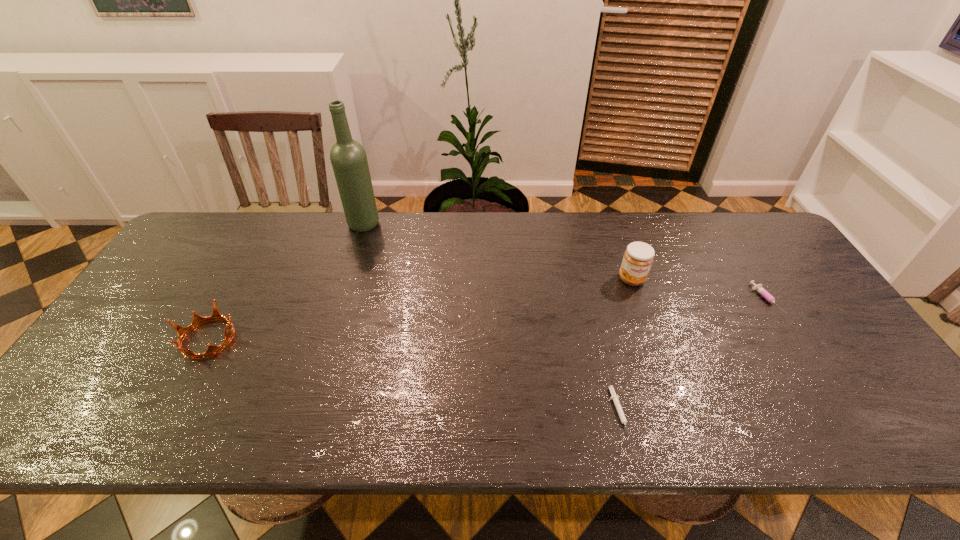
You are a GUI agent. You are given a task and a screenshot of the screen. Output one action in this format:
    pyautogui.click(x=<x>, y=<y>)
    Task: Click on the wine bottle
    This screenshot has height=540, width=960.
    Given the screenshot: What is the action you would take?
    pyautogui.click(x=348, y=157)

Where is `the tallest object`? The height and width of the screenshot is (540, 960). the tallest object is located at coordinates (348, 157).

At what (x,y) coordinates should I click in order to perform the action: click on jam. Please return your answer as a coordinate pair (x, y). Looking at the image, I should click on (638, 257).

This screenshot has height=540, width=960. I want to click on the second tallest object, so click(638, 257).

You are a GUI agent. You are given a task and a screenshot of the screen. Output one action in this format:
    pyautogui.click(x=<x>, y=<y>)
    Task: Click on the leftmost object
    The height and width of the screenshot is (540, 960).
    Given the screenshot: What is the action you would take?
    pyautogui.click(x=197, y=319)

At what (x,y) coordinates should I click in order to perform the action: click on the third shortest object. Please return your answer as a coordinate pair (x, y). The image size is (960, 540). Looking at the image, I should click on (197, 319).

Locate an element on the screen. The image size is (960, 540). the rightmost object is located at coordinates coord(758,288).

What are the coordinates of `the second shortest object` in the screenshot? It's located at (758, 288).

Find the location of a particular element. the shortest object is located at coordinates (615, 398).

You are a GUI agent. You are given a task and a screenshot of the screen. Output one action in this format:
    pyautogui.click(x=<x>, y=<y>)
    Task: Click on the shorter syringe
    
    Given the screenshot: What is the action you would take?
    pyautogui.click(x=615, y=398)